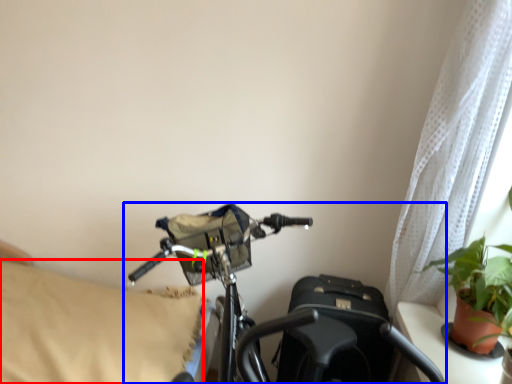
Question: Which object appears closest to the camera in this image, pillow (highlighted by a red box) or bicycle (highlighted by a blue box)?

Choices:
 (A) pillow
 (B) bicycle

Answer: (B)